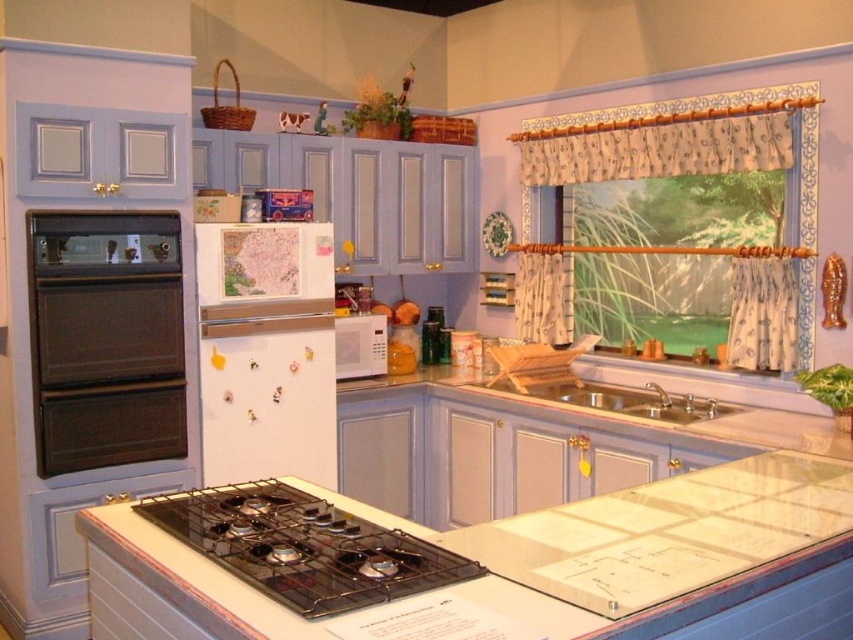
Question: Which is farther from the white matte refrigerator at center?

Choices:
 (A) white glossy countertop at center
 (B) black matte gas stove at center

Answer: (B)

Question: Is matte black oven at left behind white matte refrigerator at center?

Choices:
 (A) no
 (B) yes

Answer: (A)

Question: Is matte black oven at left smaller than white matte microwave at center?

Choices:
 (A) yes
 (B) no

Answer: (B)

Question: Does white glossy countertop at center have a larger size compared to silver metallic sink at center?

Choices:
 (A) no
 (B) yes

Answer: (B)

Question: Which object is positioned farthest from the black matte gas stove at center?

Choices:
 (A) matte black oven at left
 (B) white matte microwave at center

Answer: (B)

Question: Which object appears closest to the camera in this image?

Choices:
 (A) black matte gas stove at center
 (B) white matte refrigerator at center
 (C) white glossy countertop at center
 (D) silver metallic sink at center

Answer: (C)